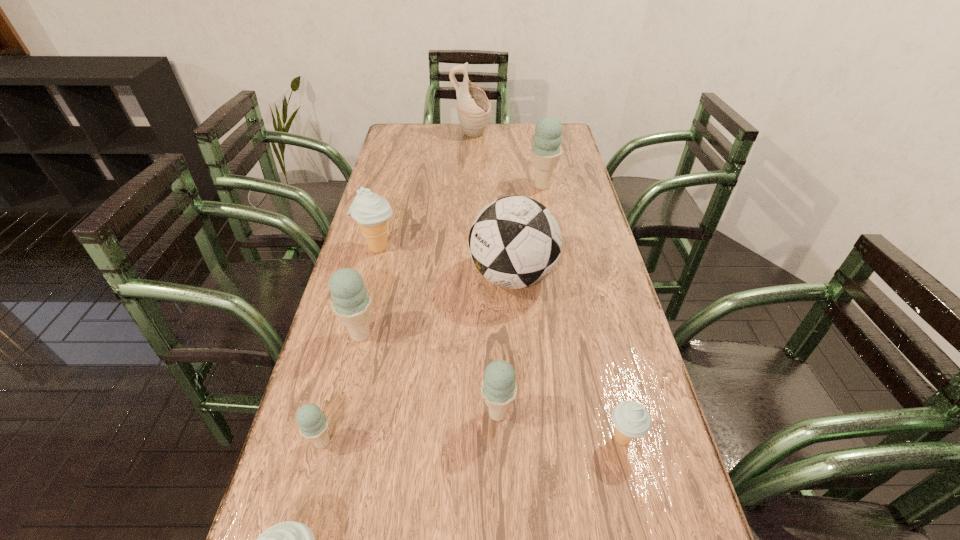
Find the location of a particular element. The height and width of the screenshot is (540, 960). the closest beige icecream to the rightmost beige icecream is located at coordinates (289, 539).

Identify the location of free spot that satisfies the following two spatial constraints: 1. on the front side of the third smallest blue ice cream; 2. on the right side of the third ice cream from right to left. The height and width of the screenshot is (540, 960). (342, 413).

At what (x,y) coordinates should I click in order to perform the action: click on vacant space that satisfies the following two spatial constraints: 1. on the surface of the black soccer ball where the brand logo is visible; 2. on the front side of the third nearest blue ice cream. Please return your answer as a coordinate pair (x, y). Looking at the image, I should click on (516, 335).

I want to click on free spot that satisfies the following two spatial constraints: 1. at the spout of the farthest object; 2. on the front side of the smallest blue ice cream, so 463,442.

Where is `vacant area that satisfies the following two spatial constraints: 1. on the surface of the black soccer ball where the brand logo is visible; 2. on the back side of the second farthest beige icecream`? vacant area that satisfies the following two spatial constraints: 1. on the surface of the black soccer ball where the brand logo is visible; 2. on the back side of the second farthest beige icecream is located at coordinates (525, 439).